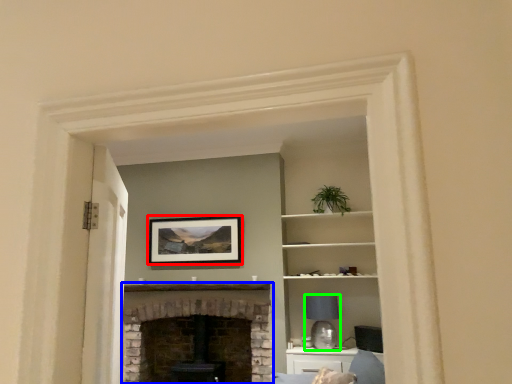
Question: Which object is positioned farthest from picture frame (highlighted by a red box)? Select from fireplace (highlighted by a blue box) and lamp (highlighted by a green box).

Choices:
 (A) fireplace
 (B) lamp

Answer: (B)